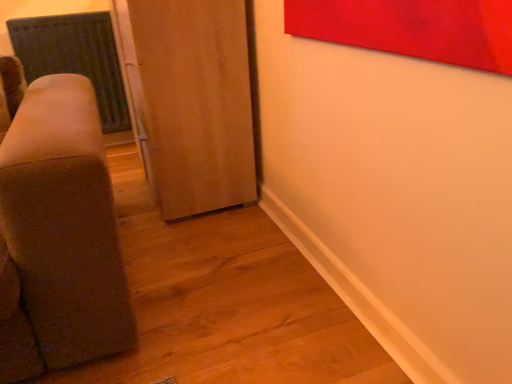
Find the location of a particular element. The width and height of the screenshot is (512, 384). free spot above satin green radiator at left (from a real-world perspective) is located at coordinates (55, 5).